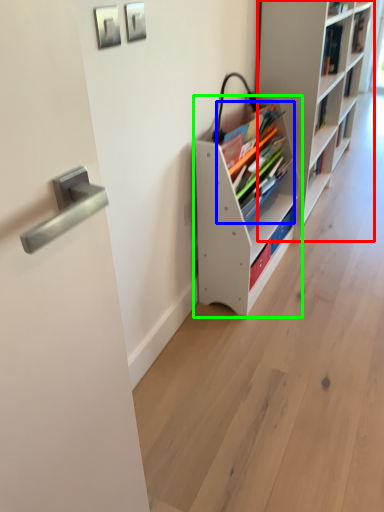
Question: Based on their relative distances, which object is farther from shelf (highlighted by a red box)? Choose from book (highlighted by a blue box) and shelf (highlighted by a green box).

Choices:
 (A) book
 (B) shelf

Answer: (A)